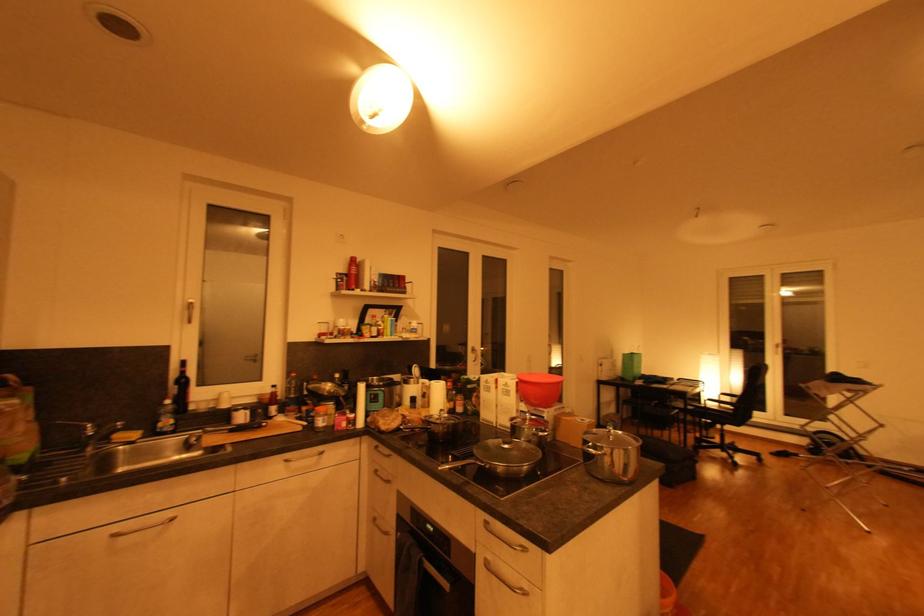
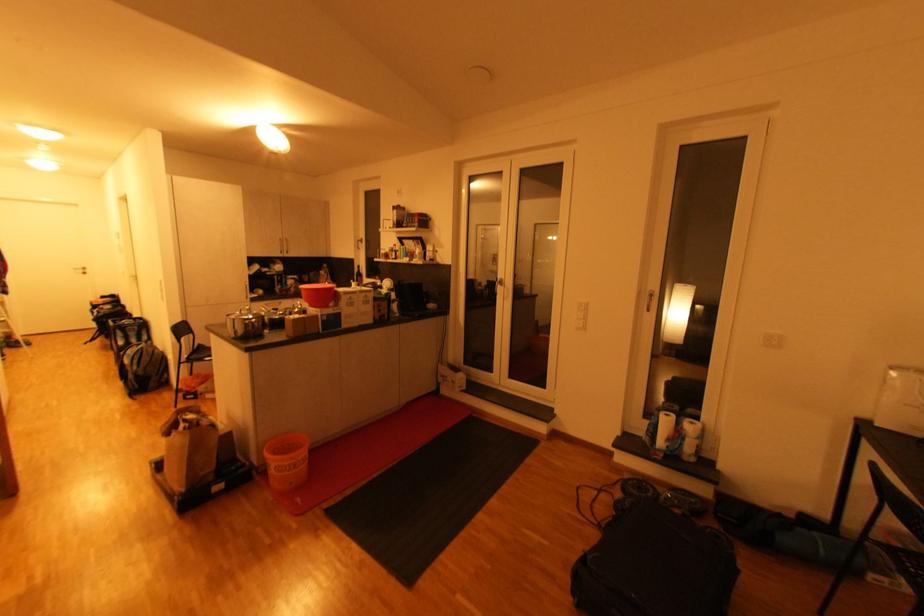
Locate, in the second image, the point that corresponds to (x=181, y=382) in the first image.

(361, 275)